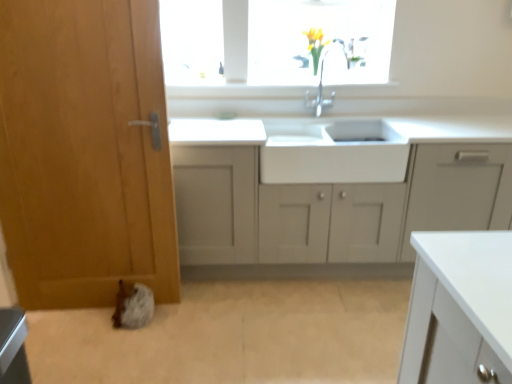
Question: From a real-world perspective, is wooden door at left located higher than white matte cabinet at center?

Choices:
 (A) no
 (B) yes

Answer: (B)

Question: Is wooden door at left outside white matte cabinet at center?

Choices:
 (A) yes
 (B) no

Answer: (A)

Question: From a real-world perspective, is wooden door at left positioned under white matte cabinet at center based on gravity?

Choices:
 (A) no
 (B) yes

Answer: (A)

Question: Is wooden door at left aimed at white matte cabinet at center?

Choices:
 (A) no
 (B) yes

Answer: (A)

Question: Is wooden door at left wider than white matte cabinet at center?

Choices:
 (A) no
 (B) yes

Answer: (A)

Question: Is wooden door at left to the left of white matte cabinet at center from the viewer's perspective?

Choices:
 (A) no
 (B) yes

Answer: (B)

Question: Is white matte cabinet at center positioned in front of white glossy sink at center?

Choices:
 (A) yes
 (B) no

Answer: (A)

Question: Is white matte cabinet at center at the right side of white glossy sink at center?

Choices:
 (A) no
 (B) yes

Answer: (B)

Question: Is white matte cabinet at center not near white glossy sink at center?

Choices:
 (A) yes
 (B) no

Answer: (B)

Question: Is white matte cabinet at center to the left of white glossy sink at center from the viewer's perspective?

Choices:
 (A) yes
 (B) no

Answer: (B)

Question: Is white matte cabinet at center touching white glossy sink at center?

Choices:
 (A) yes
 (B) no

Answer: (B)

Question: Does white matte cabinet at center lie behind white glossy sink at center?

Choices:
 (A) no
 (B) yes

Answer: (A)

Question: Is white glossy sink at center smaller than wooden door at left?

Choices:
 (A) no
 (B) yes

Answer: (B)